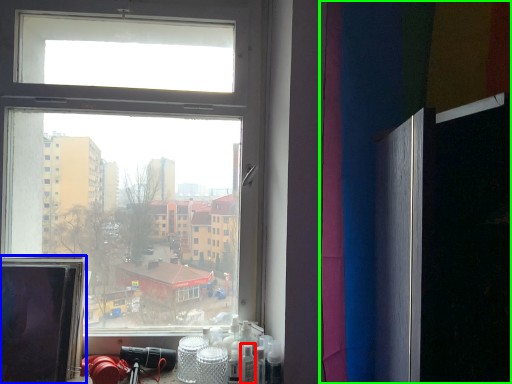
Question: Which object is the farthest from toiletry (highlighted by a red box)? Choose among these: computer screen (highlighted by a blue box) or curtain (highlighted by a green box).

Choices:
 (A) computer screen
 (B) curtain

Answer: (B)